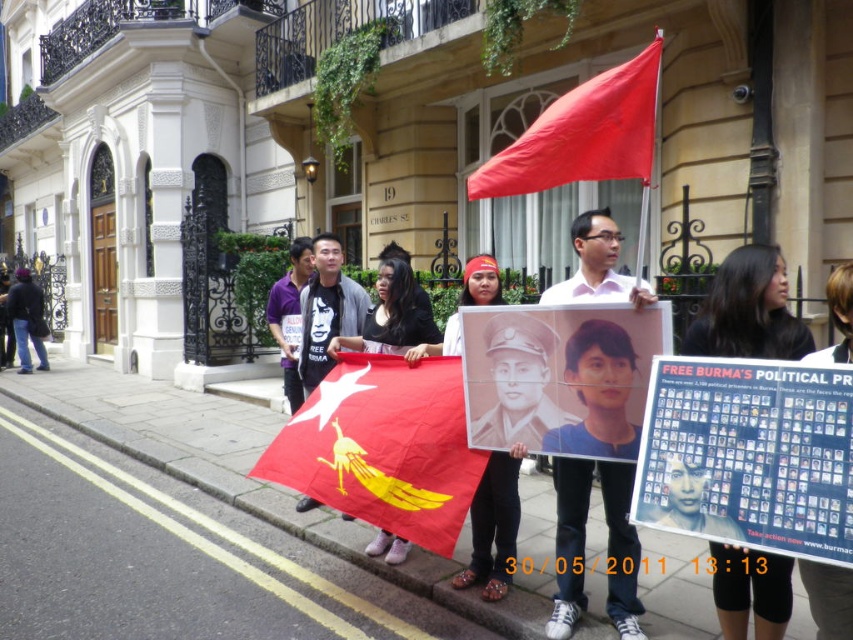
Find the location of a particular element. solid red flag at upper center is located at coordinates (583, 134).

Is solid red flag at upper center bigger than dark blue jeans at left?

No, solid red flag at upper center is not bigger than dark blue jeans at left.

Is point (624, 83) in front of point (36, 346)?

That is True.

Find the location of `solid red flag at upper center`. solid red flag at upper center is located at coordinates (583, 134).

Is point (360, 467) farther from camera compared to point (320, 285)?

No, it is in front of (320, 285).

Consider the image. Can you confirm if red fabric flag at center is smaller than matte black t-shirt at center?

Incorrect, red fabric flag at center is not smaller in size than matte black t-shirt at center.

What do you see at coordinates (383, 445) in the screenshot? The image size is (853, 640). I see `red fabric flag at center` at bounding box center [383, 445].

Identify the location of red fabric flag at center. (383, 445).

Which is below, blue paper poster at center or matte white shirt at center?

matte white shirt at center is below.

Does blue paper poster at center appear over matte white shirt at center?

Yes.

Image resolution: width=853 pixels, height=640 pixels. I want to click on blue paper poster at center, so click(x=749, y=456).